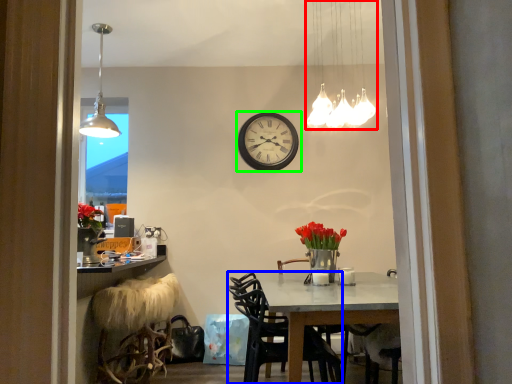
Question: Considering the real-world distances, which object is closest to lamp (highlighted by a red box)? chair (highlighted by a blue box) or wall clock (highlighted by a green box).

Choices:
 (A) chair
 (B) wall clock

Answer: (B)